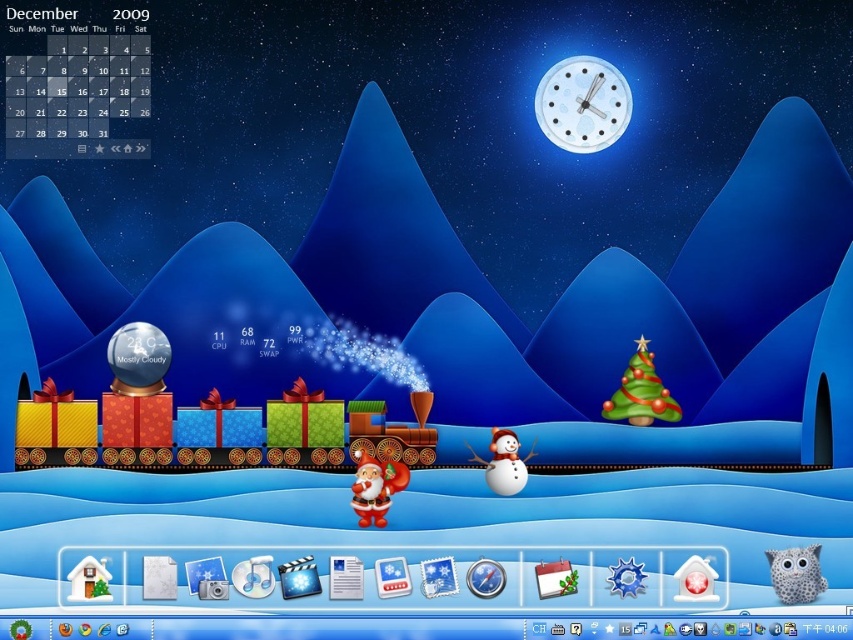
You are setting up a holiday display and want to place a small Santa figurine between the white plastic clock at upper center and the white matte snowman at center. Based on their positions, where should you place Santa so he is equidistant from both objects?

To place Santa equidistant between the white plastic clock at upper center and the white matte snowman at center, position him directly in the middle along the vertical line connecting them since the clock is above the snowman.

You are standing at the camera position in the image. There is a white plastic clock at upper center that you want to reach. Can you walk straight towards it without any obstacles?

The white plastic clock at upper center and camera are 5.26 meters apart from each other, so you can walk straight towards it without any obstacles since there is no mention of obstacles in the scene description.

You are looking at the festive desktop background and want to place a new decoration between the two points, point (549, 116) and point (508, 456). Which point is closer to you so you can start placing the decoration there?

Point (549, 116) is further to the viewer than point (508, 456), so the closer point to you is point (508, 456). Start placing the decoration near that point.